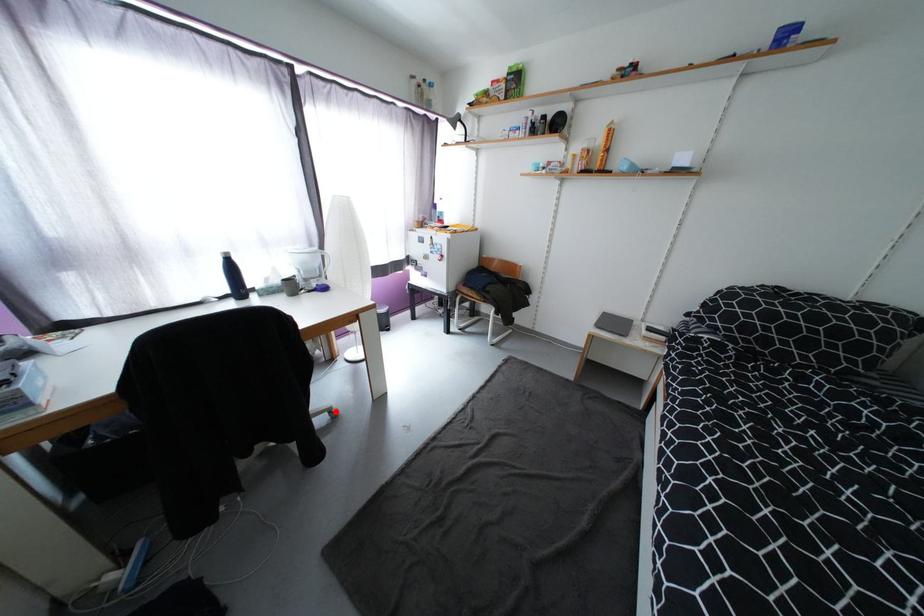
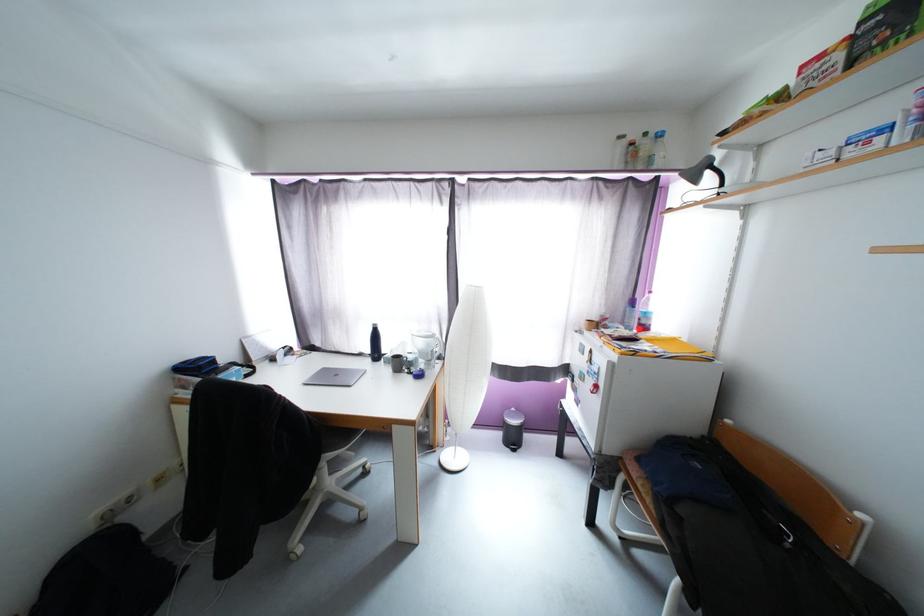
Question: I am providing you with two images of the same scene from different viewpoints. In image1, a red point is highlighted. Considering the same 3D point in image2, which of the following is correct?

Choices:
 (A) It is closer
 (B) It is farther

Answer: (A)